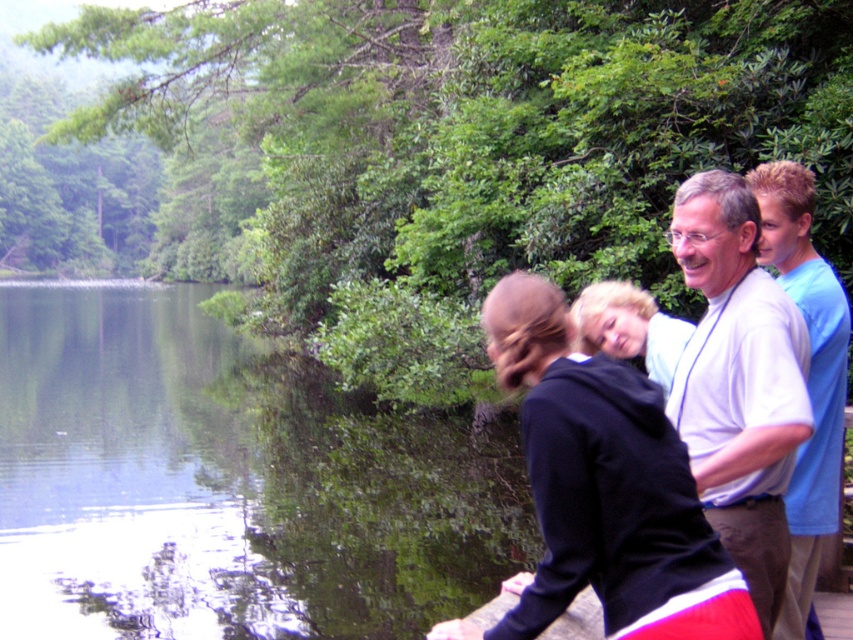
You are a photographer trying to capture a group photo of the black hoodie at center and the blue cotton shirt at right. Which one should you focus on first if you want to ensure both are in focus?

The black hoodie at center is shorter than the blue cotton shirt at right, so you should focus on the blue cotton shirt at right first to ensure both are in focus.

You are a photographer trying to capture a group photo of the black hoodie at center and the blue cotton shirt at right. Which clothing item should you focus on first if you want to ensure both are in frame without moving the camera?

The black hoodie at center is smaller than the blue cotton shirt at right, so you should focus on the blue cotton shirt at right first to ensure it fits within the frame since it takes up more space.

In the scene shown: You are a photographer trying to capture a group photo of the white cotton shirt at upper right and the blue cotton shirt at right. Which shirt should you focus on first if you want to ensure both are in frame without moving the camera?

The white cotton shirt at upper right is smaller than the blue cotton shirt at right, so you should focus on the white cotton shirt at upper right first to ensure it fits within the frame.